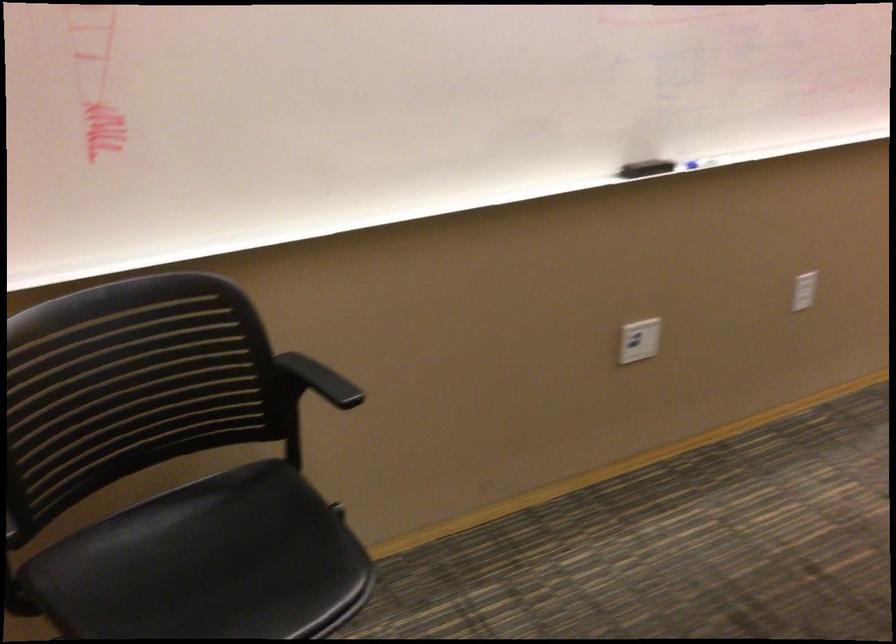
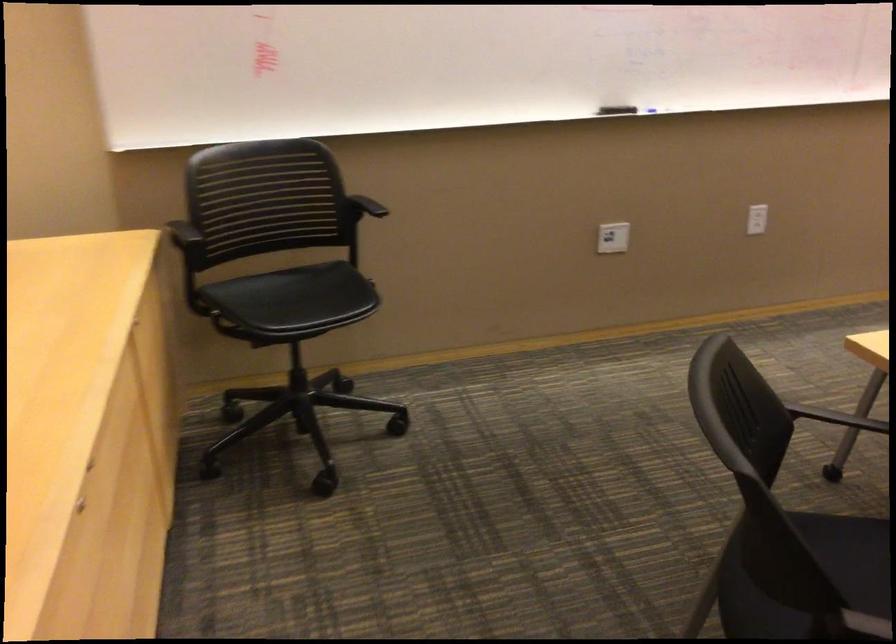
Locate, in the second image, the point that corresponds to the point at 642,172 in the first image.

(616, 109)